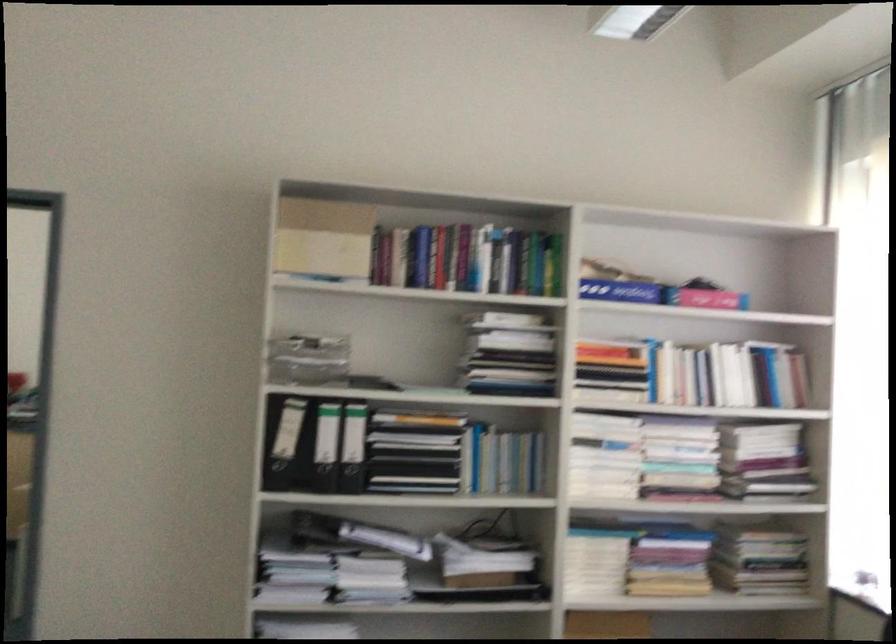
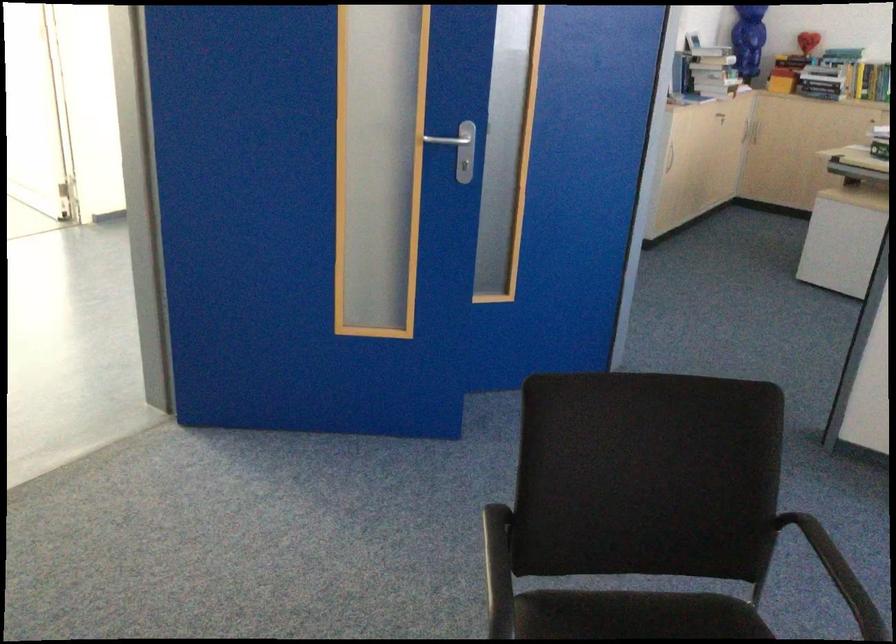
The images are taken continuously from a first-person perspective. In which direction is your viewpoint rotating?

The rotation direction of the camera is left-down.